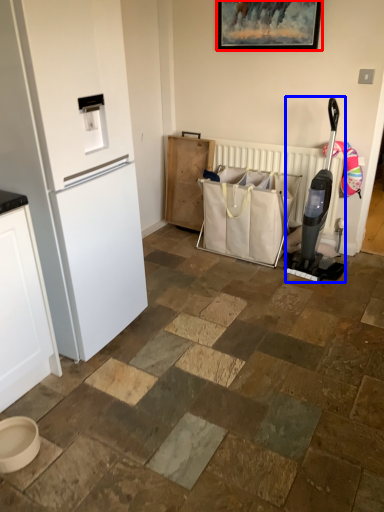
Question: Which object is closer to the camera taking this photo, picture frame (highlighted by a red box) or appliance (highlighted by a blue box)?

Choices:
 (A) picture frame
 (B) appliance

Answer: (B)